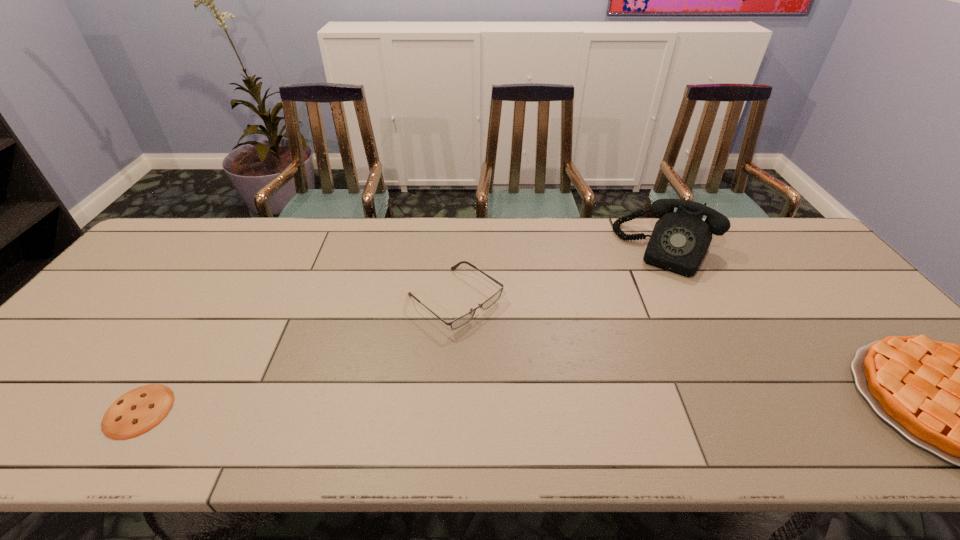
Where is `vacant region located on the dial of the second object from right to left`? The width and height of the screenshot is (960, 540). vacant region located on the dial of the second object from right to left is located at coordinates (641, 301).

The height and width of the screenshot is (540, 960). In order to click on free space located on the dial of the second object from right to left in this screenshot , I will do `click(623, 339)`.

Image resolution: width=960 pixels, height=540 pixels. What are the coordinates of `vacant point located 0.230m on the dial of the second object from right to left` in the screenshot? It's located at (631, 324).

Where is `object positioned at the far edge`? The height and width of the screenshot is (540, 960). object positioned at the far edge is located at coordinates (680, 240).

At what (x,y) coordinates should I click in order to perform the action: click on object that is at the near edge. Please return your answer as a coordinate pair (x, y). This screenshot has height=540, width=960. Looking at the image, I should click on (137, 411).

Locate an element on the screen. The height and width of the screenshot is (540, 960). vacant area at the far edge is located at coordinates (233, 235).

Locate an element on the screen. This screenshot has width=960, height=540. free space at the near edge of the desktop is located at coordinates (612, 396).

You are a GUI agent. You are given a task and a screenshot of the screen. Output one action in this format:
    pyautogui.click(x=<x>, y=<y>)
    Task: Click on the free space at the left edge of the desktop
    This screenshot has height=540, width=960.
    Given the screenshot: What is the action you would take?
    pyautogui.click(x=141, y=302)

Identify the location of vacant area at the right edge. (854, 347).

In the image, there is a desktop. Where is `vacant region at the far left corner`? vacant region at the far left corner is located at coordinates (210, 232).